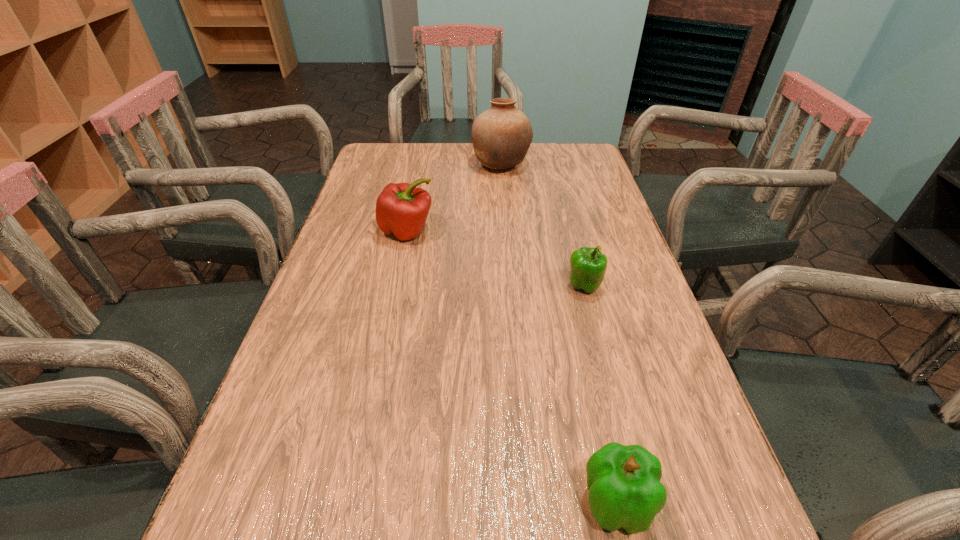
I want to click on the farthest object, so click(x=501, y=136).

This screenshot has width=960, height=540. Find the location of `pottery`. pottery is located at coordinates (501, 136).

At what (x,y) coordinates should I click in order to perform the action: click on the leftmost object. Please return your answer as a coordinate pair (x, y). Looking at the image, I should click on (401, 209).

Where is `the third nearest object`? the third nearest object is located at coordinates (401, 209).

Where is `the second farthest bell pepper`? the second farthest bell pepper is located at coordinates (588, 266).

Identify the location of vacant space located on the left of the tallest object. The height and width of the screenshot is (540, 960). (450, 165).

Identify the location of vacant space located on the back of the second farthest object. This screenshot has height=540, width=960. (420, 165).

The width and height of the screenshot is (960, 540). I want to click on vacant space situated on the right of the second nearest bell pepper, so click(x=640, y=286).

Image resolution: width=960 pixels, height=540 pixels. I want to click on object located in the far edge section of the desktop, so click(x=501, y=136).

Find the location of a particular element. object that is at the left edge is located at coordinates (401, 209).